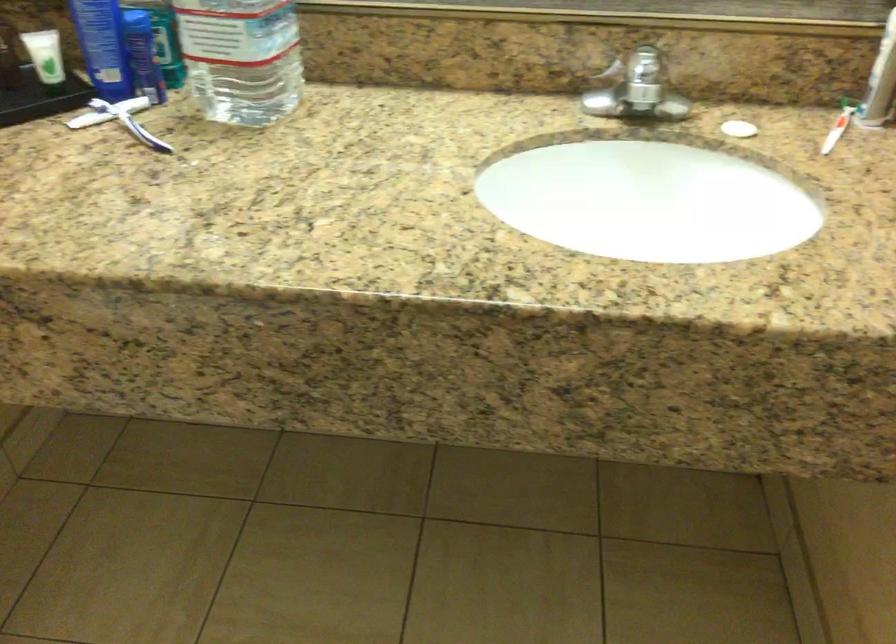
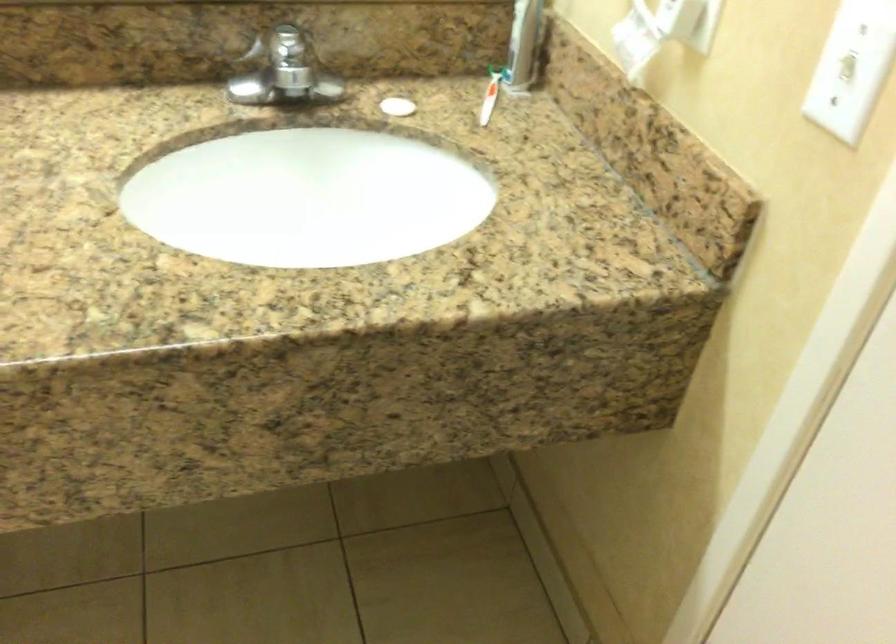
In the second image, find the point that corresponds to point 735,125 in the first image.

(398, 106)